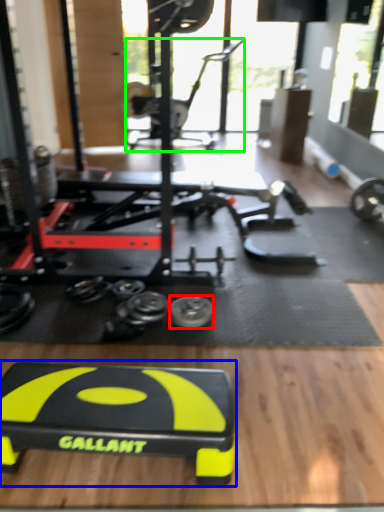
Question: Based on their relative distances, which object is nearer to tire (highlighted by a red box)? Choose from sport equipment (highlighted by a blue box) and sport equipment (highlighted by a green box).

Choices:
 (A) sport equipment
 (B) sport equipment

Answer: (A)